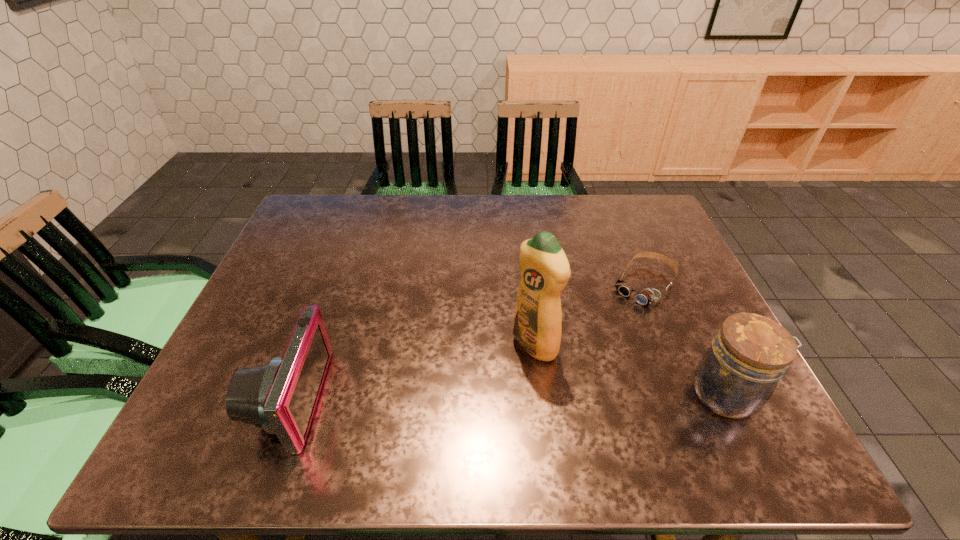
You are a GUI agent. You are given a task and a screenshot of the screen. Output one action in this format:
    pyautogui.click(x=<x>, y=<y>)
    Task: Click on the vacant space that satisfies the following two spatial constraints: 1. on the front side of the third shortest object; 2. on the lid of the shortest object
    The height and width of the screenshot is (540, 960).
    Given the screenshot: What is the action you would take?
    pyautogui.click(x=687, y=394)

Locate an element on the screen. free location that satisfies the following two spatial constraints: 1. on the front side of the second tallest object; 2. on the lid of the tallest object is located at coordinates (540, 394).

At what (x,y) coordinates should I click in order to perform the action: click on free space in the image that satisfies the following two spatial constraints: 1. on the front side of the third shortest object; 2. on the lid of the tallest object. Please return your answer as a coordinate pair (x, y). This screenshot has width=960, height=540. Looking at the image, I should click on (540, 394).

Locate an element on the screen. The height and width of the screenshot is (540, 960). free point that satisfies the following two spatial constraints: 1. on the front side of the goggles; 2. on the lid of the second tallest object is located at coordinates (687, 394).